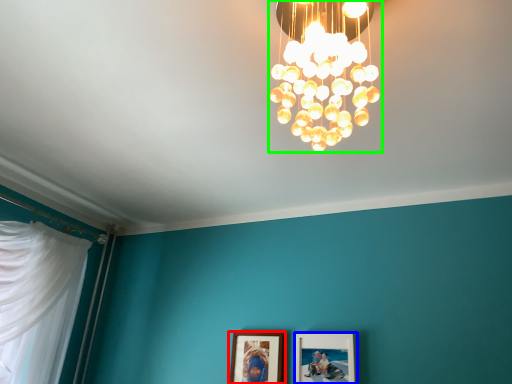
Question: Which is nearer to the picture frame (highlighted by a red box)? picture frame (highlighted by a blue box) or lamp (highlighted by a green box).

Choices:
 (A) picture frame
 (B) lamp

Answer: (A)